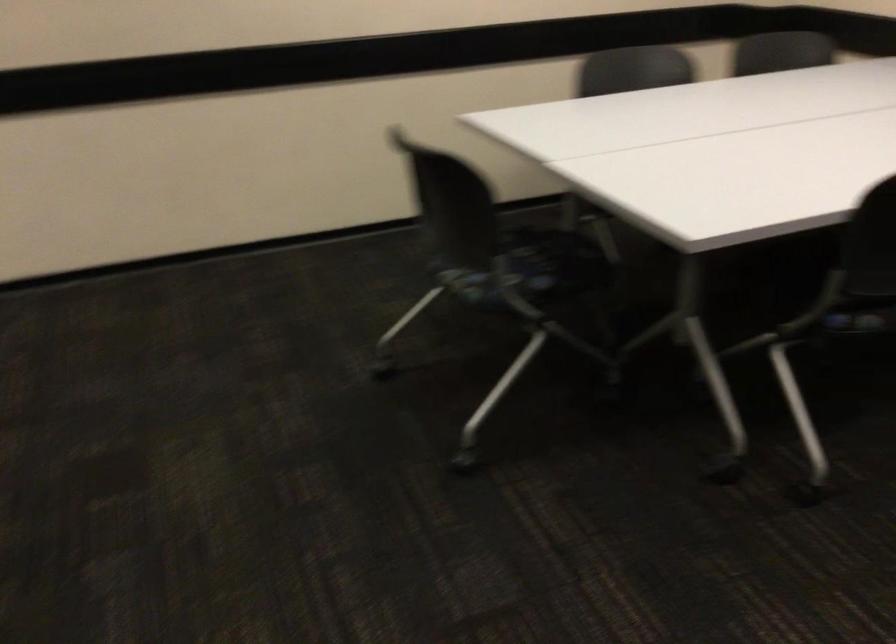
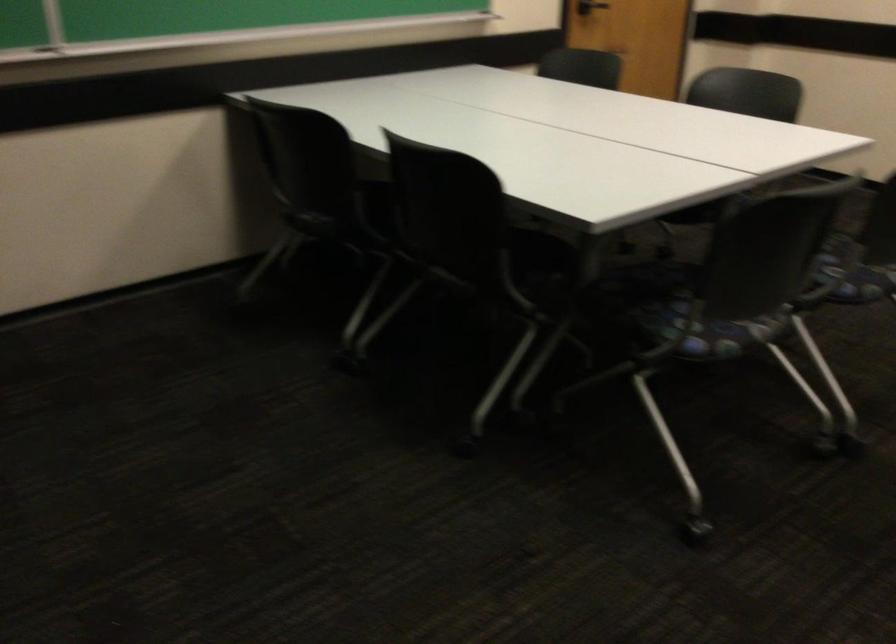
Looking at this image, based on the continuous images, in which direction is the camera rotating?

The rotation direction of the camera is left-down.